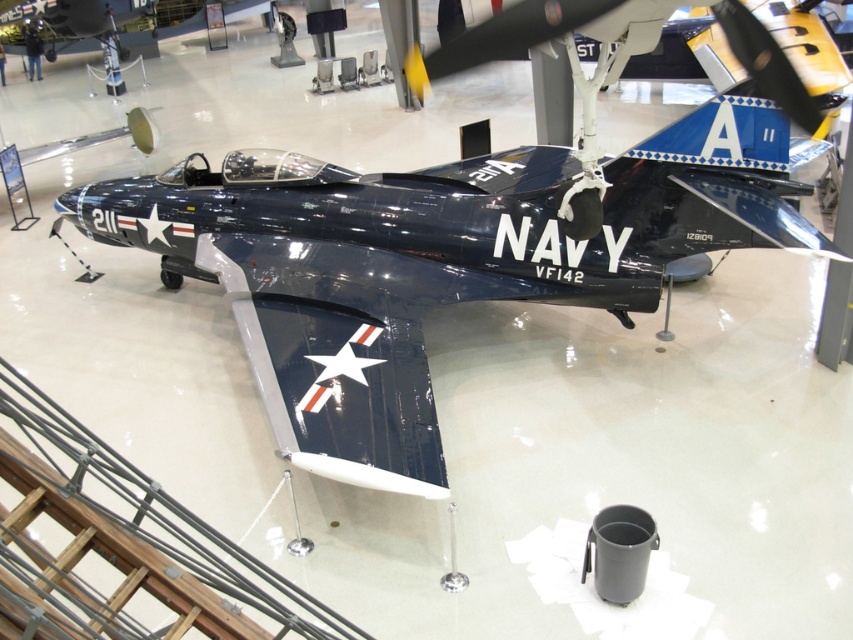
Question: Does glossy navy blue airplane at center have a greater width compared to glossy metallic airplane at center?

Choices:
 (A) yes
 (B) no

Answer: (B)

Question: Which of the following is the farthest from the observer?

Choices:
 (A) glossy metallic airplane at center
 (B) glossy navy blue airplane at center

Answer: (A)

Question: Which point is closer to the camera taking this photo?

Choices:
 (A) pos(35,3)
 (B) pos(234,244)

Answer: (B)

Question: In this image, where is glossy navy blue airplane at center located relative to glossy metallic airplane at center?

Choices:
 (A) below
 (B) above

Answer: (A)

Question: From the image, what is the correct spatial relationship of glossy navy blue airplane at center in relation to glossy metallic airplane at center?

Choices:
 (A) left
 (B) right

Answer: (B)